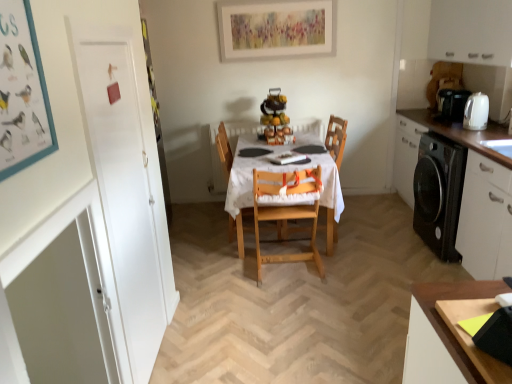
Where is `spots to the right of wooden table at center`? spots to the right of wooden table at center is located at coordinates (382, 232).